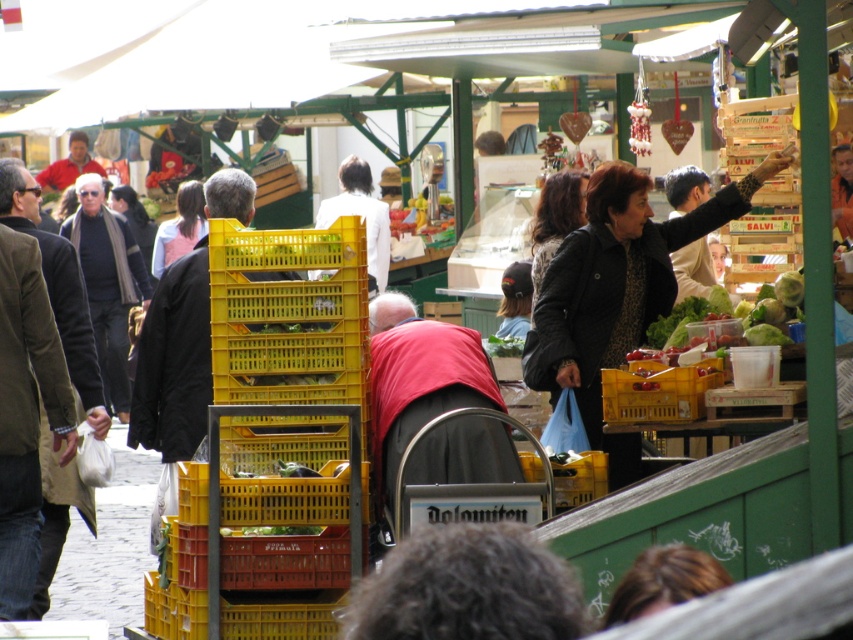
Question: Which is farther from the yellow plastic crate at center?

Choices:
 (A) green leafy lettuce at center
 (B) dark brown leather jacket at center

Answer: (B)

Question: Which of these objects is positioned farthest from the dark brown leather jacket at center?

Choices:
 (A) matte black jacket at center
 (B) black textured coat at upper right
 (C) green leafy lettuce at center
 (D) yellow plastic crate at center

Answer: (A)

Question: Which of these objects is positioned closest to the green leafy lettuce at center?

Choices:
 (A) yellow plastic crate at center
 (B) black textured coat at upper right
 (C) dark brown leather jacket at center
 (D) matte black jacket at center

Answer: (A)

Question: Is yellow plastic crate at center positioned behind matte black jacket at center?

Choices:
 (A) yes
 (B) no

Answer: (B)

Question: Does black textured coat at upper right have a lesser width compared to dark brown leather jacket at center?

Choices:
 (A) yes
 (B) no

Answer: (B)

Question: Is dark brown leather jacket at center bigger than green leafy lettuce at center?

Choices:
 (A) yes
 (B) no

Answer: (A)